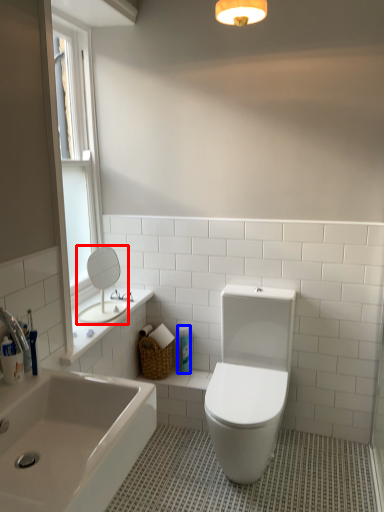
Question: Which object is further to the camera taking this photo, mirror (highlighted by a red box) or toiletry (highlighted by a blue box)?

Choices:
 (A) mirror
 (B) toiletry

Answer: (B)